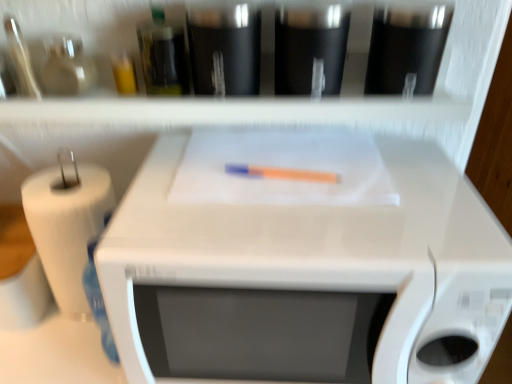
Identify the location of free space in front of orange matte crayon at center. Image resolution: width=512 pixels, height=384 pixels. (296, 229).